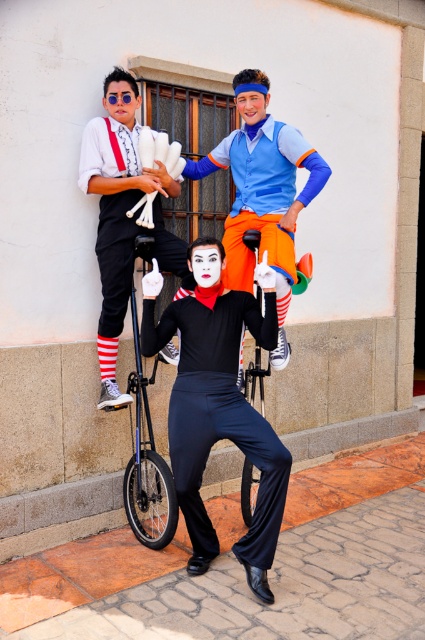
You are a costume designer observing the scene. Which object takes up more space in the image between the black satin pants at center and the matte white gloves at upper left?

The black satin pants at center takes up more space in the image than the matte white gloves at upper left because it is larger in size.

You are a stagehand responsible for setting up the performance area. The safety guidelines state that performers must maintain a minimum distance of 50 centimeters between their lower body clothing and any metal equipment to prevent entanglement. Based on the image, is the distance between the black satin pants at center and the shiny black monocycle at center compliant with the safety guidelines?

The distance between the black satin pants at center and the shiny black monocycle at center is 44.32 centimeters, which is less than the required 50 centimeters. Therefore, it does not comply with the safety guidelines.